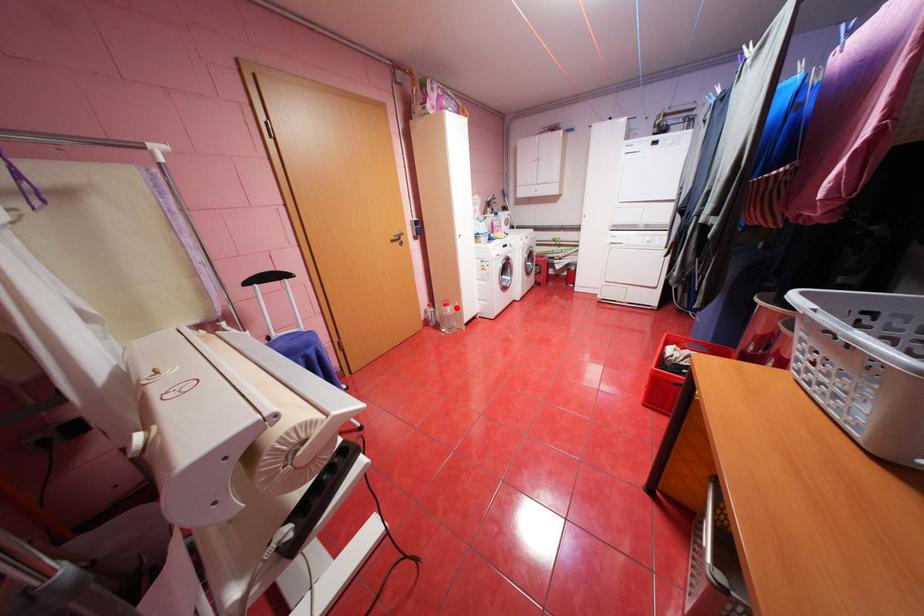
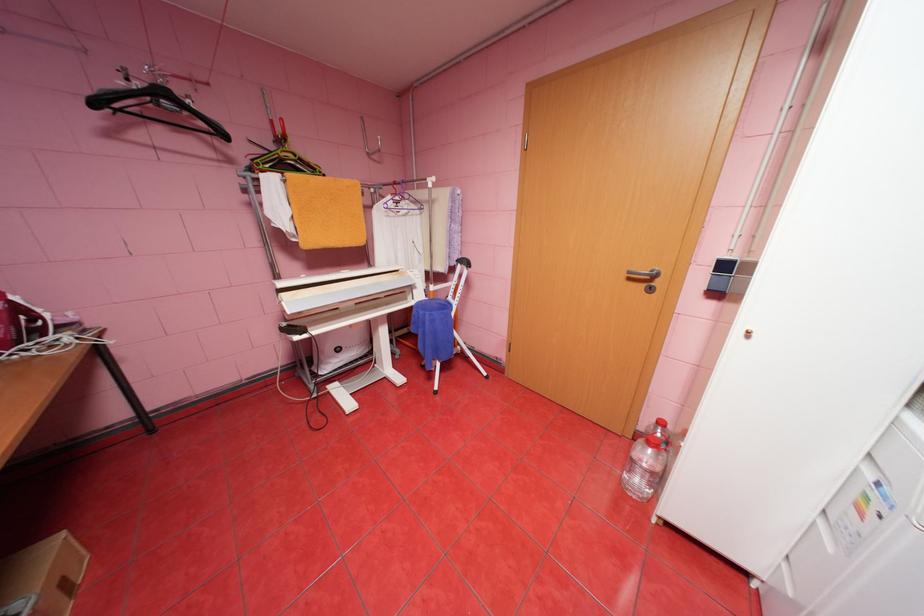
In the second image, find the point that corresponds to the highlighted location in the first image.

(659, 451)